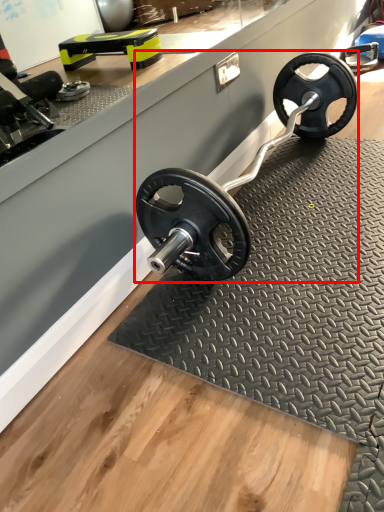
Question: Considering the relative positions of sport equipment (annotated by the red box) and mat in the image provided, where is sport equipment (annotated by the red box) located with respect to the staircase?

Choices:
 (A) right
 (B) left

Answer: (B)